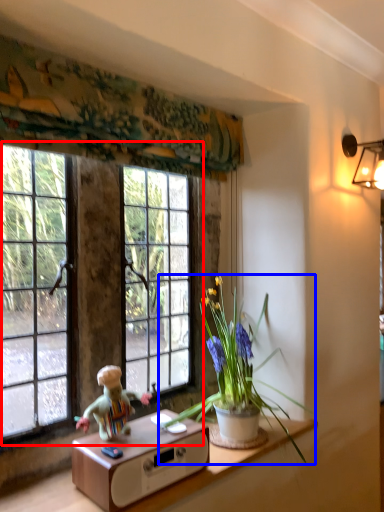
Question: Which of the following is the farthest to the observer, window (highlighted by a red box) or houseplant (highlighted by a blue box)?

Choices:
 (A) window
 (B) houseplant

Answer: (A)